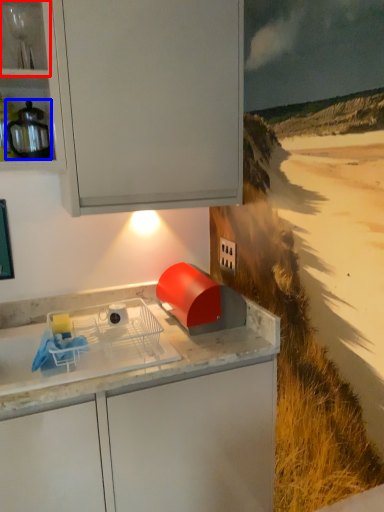
Question: Which object is further to the camera taking this photo, shelf (highlighted by a red box) or kitchen appliance (highlighted by a blue box)?

Choices:
 (A) shelf
 (B) kitchen appliance

Answer: (B)